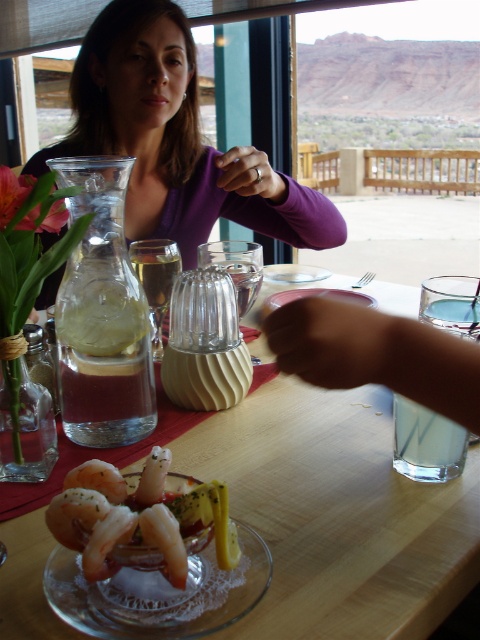
Is point (192, 582) positioned before point (260, 172)?

Yes, point (192, 582) is in front of point (260, 172).

This screenshot has height=640, width=480. I want to click on clear glass plate at center, so click(x=158, y=593).

Is point (122, 99) farther from viewer compared to point (212, 586)?

That is True.

Can you confirm if purple fabric shirt at upper center is positioned to the right of clear glass plate at center?

In fact, purple fabric shirt at upper center is to the left of clear glass plate at center.

Is point (175, 220) in front of point (106, 593)?

No, it is not.

Locate an element on the screen. purple fabric shirt at upper center is located at coordinates (168, 136).

Can you confirm if shiny pink shrimp at center is positioned below matte purple shirt at upper center?

Indeed, shiny pink shrimp at center is positioned under matte purple shirt at upper center.

Measure the distance from shiny pink shrimp at center to matte purple shirt at upper center.

shiny pink shrimp at center and matte purple shirt at upper center are 21.81 inches apart from each other.

Which is in front, point (226, 513) or point (223, 156)?

Positioned in front is point (226, 513).

At what (x,y) coordinates should I click in order to perform the action: click on shiny pink shrimp at center. Please return your answer as a coordinate pair (x, y). The image size is (480, 640). Looking at the image, I should click on pos(140,516).